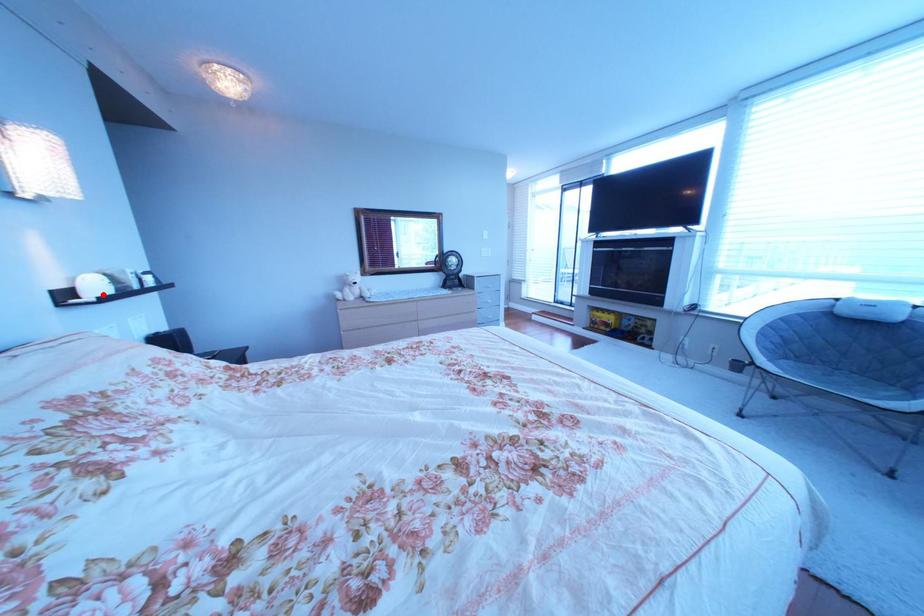
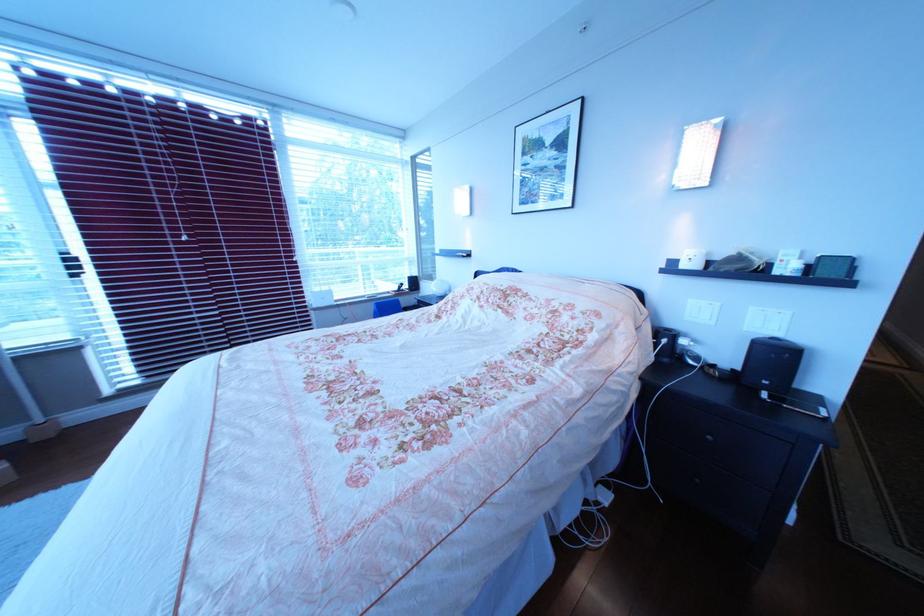
The point at the highlighted location is marked in the first image. Where is the corresponding point in the second image?

(699, 267)